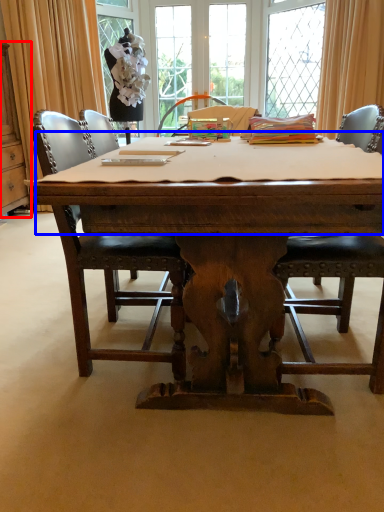
Question: Which object appears closest to the camera in this image, cabinetry (highlighted by a red box) or tablecloth (highlighted by a blue box)?

Choices:
 (A) cabinetry
 (B) tablecloth

Answer: (B)